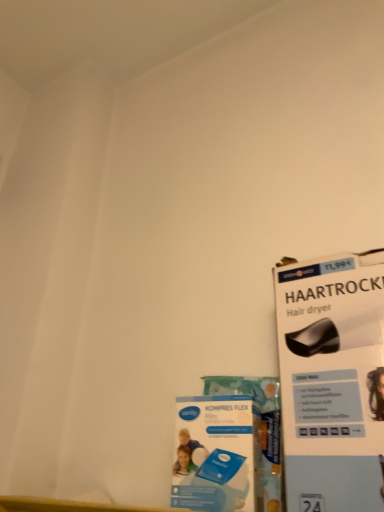
Question: From their relative heights in the image, would you say blue cardboard flyer at lower center is taller or shorter than white cardboard hair dryer at upper right?

Choices:
 (A) short
 (B) tall

Answer: (A)

Question: From a real-world perspective, relative to white cardboard hair dryer at upper right, is blue cardboard flyer at lower center vertically above or below?

Choices:
 (A) below
 (B) above

Answer: (A)

Question: Would you say blue cardboard flyer at lower center is inside or outside white cardboard hair dryer at upper right?

Choices:
 (A) outside
 (B) inside

Answer: (A)

Question: Considering the positions of point (284, 394) and point (235, 486), is point (284, 394) closer or farther from the camera than point (235, 486)?

Choices:
 (A) farther
 (B) closer

Answer: (A)

Question: Considering the positions of white cardboard hair dryer at upper right and blue cardboard flyer at lower center in the image, is white cardboard hair dryer at upper right bigger or smaller than blue cardboard flyer at lower center?

Choices:
 (A) small
 (B) big

Answer: (B)

Question: Visually, is white cardboard hair dryer at upper right positioned to the left or to the right of blue cardboard flyer at lower center?

Choices:
 (A) right
 (B) left

Answer: (A)

Question: From the image's perspective, relative to blue cardboard flyer at lower center, is white cardboard hair dryer at upper right above or below?

Choices:
 (A) above
 (B) below

Answer: (A)